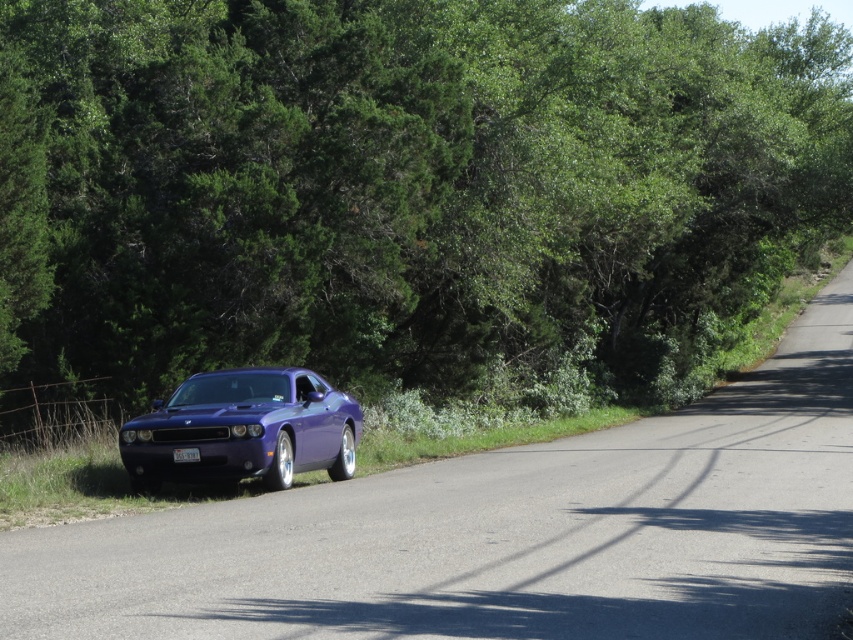
Question: Is green leafy tree at center to the right of glossy metallic car at center from the viewer's perspective?

Choices:
 (A) yes
 (B) no

Answer: (A)

Question: Is green leafy tree at center wider than glossy metallic car at center?

Choices:
 (A) yes
 (B) no

Answer: (A)

Question: Is green leafy tree at center thinner than glossy metallic car at center?

Choices:
 (A) yes
 (B) no

Answer: (B)

Question: Among these objects, which one is farthest from the camera?

Choices:
 (A) green leafy tree at center
 (B) glossy metallic car at center

Answer: (A)

Question: Which of the following is the closest to the observer?

Choices:
 (A) (143, 460)
 (B) (712, 291)

Answer: (A)